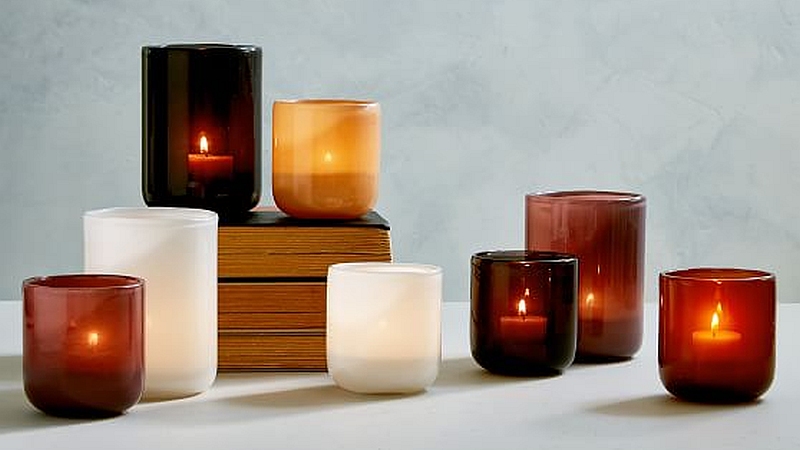
Identify the location of candle. The width and height of the screenshot is (800, 450). (734, 371), (604, 306), (514, 332), (376, 315), (324, 159), (196, 143), (169, 290), (74, 343).